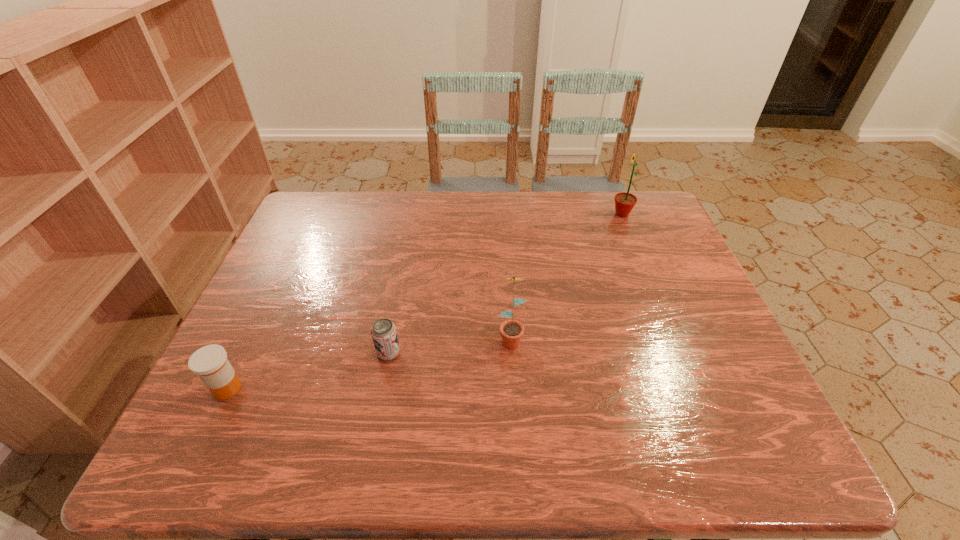
The image size is (960, 540). Find the location of `free region at the right edge of the desktop`. free region at the right edge of the desktop is located at coordinates (701, 286).

The width and height of the screenshot is (960, 540). In the image, there is a desktop. In order to click on blank space at the far left corner in this screenshot , I will do `click(306, 218)`.

In order to click on vacant space at the near left corner of the desktop in this screenshot , I will do `click(192, 465)`.

Where is `free space at the far right corner of the desktop`? free space at the far right corner of the desktop is located at coordinates (656, 208).

Where is `vacant space at the near right corner of the desktop`? vacant space at the near right corner of the desktop is located at coordinates (725, 450).

I want to click on vacant area that lies between the leftmost object and the nearer sunflower, so click(369, 363).

Identify the location of unoccupied position between the beer can and the taller sunflower. Image resolution: width=960 pixels, height=540 pixels. (505, 284).

Image resolution: width=960 pixels, height=540 pixels. Identify the location of free space between the rightmost object and the third object from left to right. (566, 275).

This screenshot has height=540, width=960. Identify the location of free area in between the taller sunflower and the third object from right to left. (505, 284).

You are a GUI agent. You are given a task and a screenshot of the screen. Output one action in this format:
    pyautogui.click(x=<x>, y=<y>)
    Task: Click on the free point between the beer can and the right sunflower
    The image size is (960, 540).
    Given the screenshot: What is the action you would take?
    pyautogui.click(x=505, y=284)